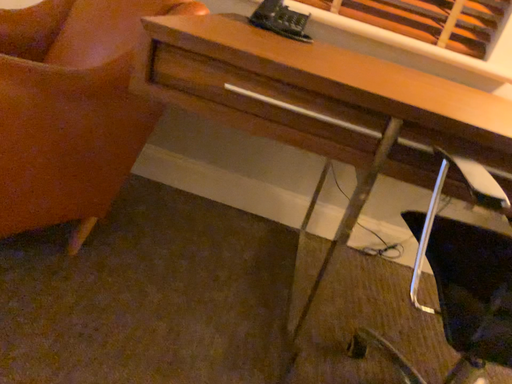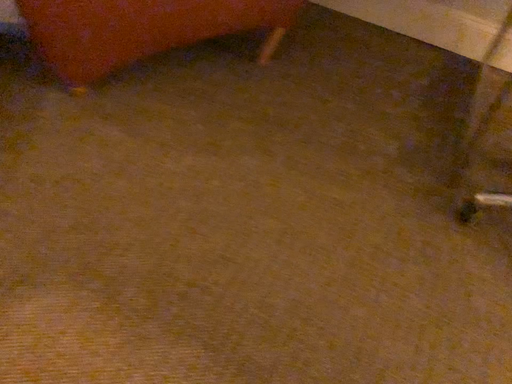
Question: How did the camera likely rotate when shooting the video?

Choices:
 (A) rotated left
 (B) rotated right

Answer: (A)